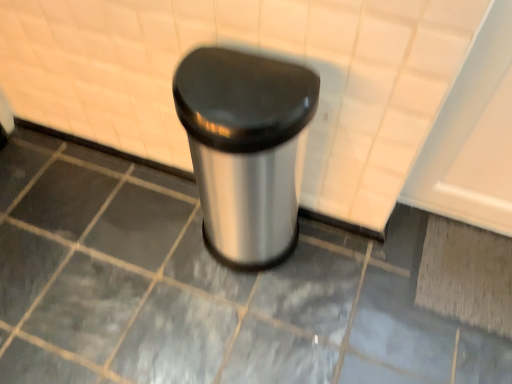
You are a GUI agent. You are given a task and a screenshot of the screen. Output one action in this format:
    pyautogui.click(x=<x>, y=<y>)
    Task: Click on the free space in front of polished stainless steel trash can at center
    
    Given the screenshot: What is the action you would take?
    pyautogui.click(x=238, y=319)